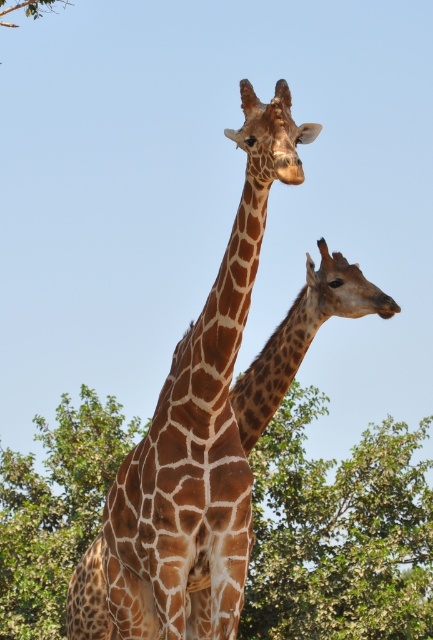
Measure the distance from green leafy tree at center to brown spotted giraffe at center.

The distance of green leafy tree at center from brown spotted giraffe at center is 72.21 feet.

Between green leafy tree at center and brown spotted giraffe at center, which one has more height?

green leafy tree at center

Who is more distant from viewer, (36, 570) or (254, 157)?

The point (36, 570) is behind.

Find the location of a particular element. The height and width of the screenshot is (640, 433). green leafy tree at center is located at coordinates (339, 532).